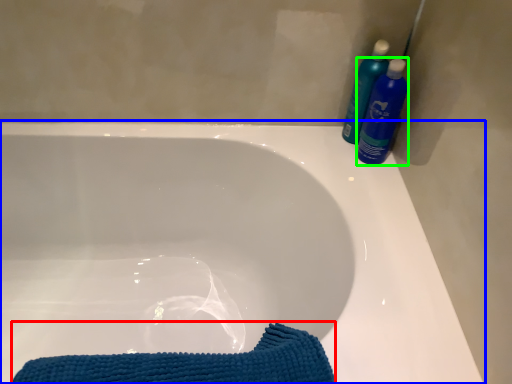
Question: Which object is positioned farthest from beach towel (highlighted by a red box)? Select from bathtub (highlighted by a blue box) and cleaning product (highlighted by a green box).

Choices:
 (A) bathtub
 (B) cleaning product

Answer: (B)